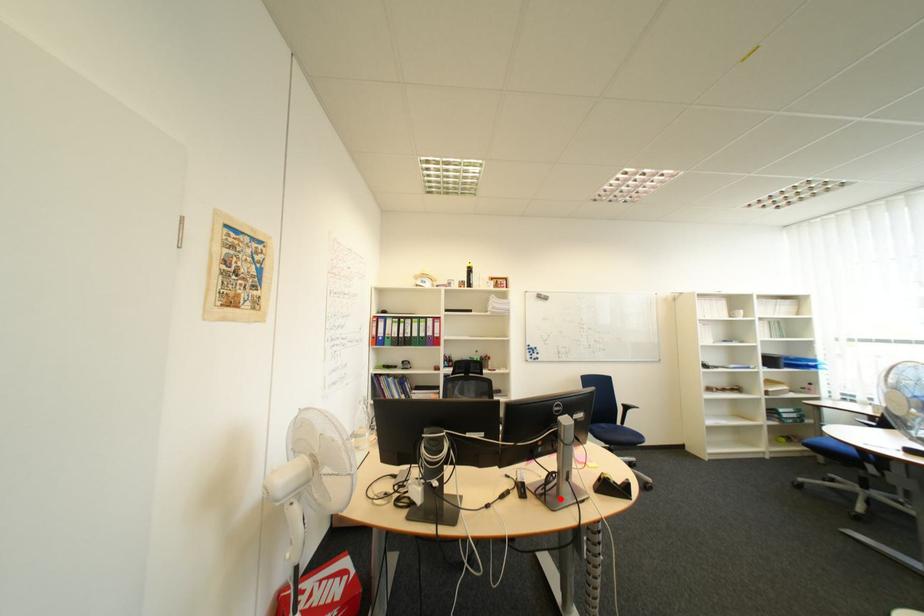
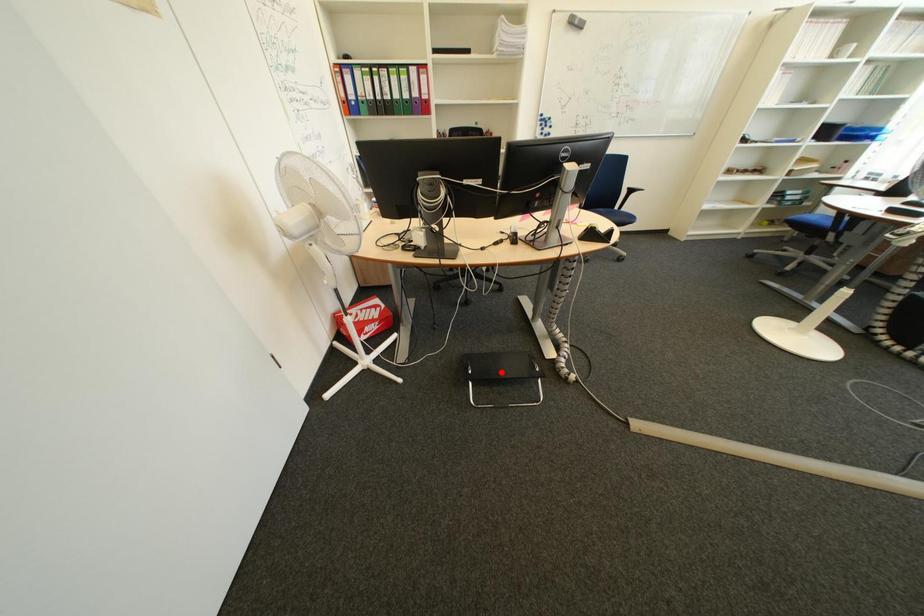
I am providing you with two images of the same scene from different viewpoints. A red point is marked on the first image and another point is marked on the second image. Are the points marked in image1 and image2 representing the same 3D position?

No